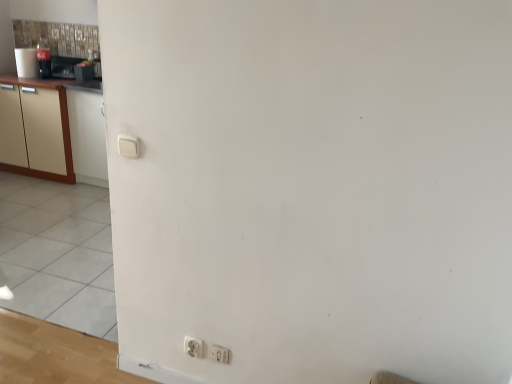
Question: Does point (210, 359) appear closer or farther from the camera than point (192, 344)?

Choices:
 (A) closer
 (B) farther

Answer: (B)

Question: Is white plastic electric outlet at lower center, which is the 1th electric outlet in right-to-left order, situated inside white plastic electric outlet at lower center, which appears as the first electric outlet when viewed from the left, or outside?

Choices:
 (A) outside
 (B) inside

Answer: (A)

Question: Estimate the real-world distances between objects in this image. Which object is closer to the white plastic electric outlet at lower center, the second electric outlet when ordered from left to right?

Choices:
 (A) white plastic electric outlet at lower center, which appears as the first electric outlet when viewed from the left
 (B) beige wood cabinetry at left
 (C) metallic silver toaster at upper left

Answer: (A)

Question: Based on their relative distances, which object is nearer to the white plastic electric outlet at lower center, the second electric outlet when ordered from left to right?

Choices:
 (A) beige wood cabinetry at left
 (B) metallic silver toaster at upper left
 (C) white plastic electric outlet at lower center, which is counted as the second electric outlet, starting from the right

Answer: (C)